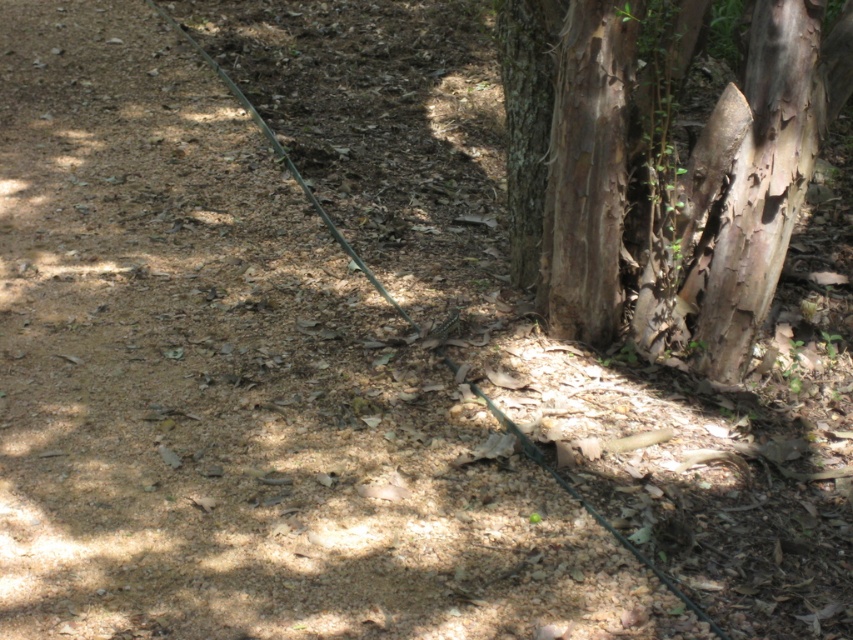
You are a hiker trying to identify two tree trunks in the forest. You see the light brown textured bark at center right and the brown rough bark tree trunk at center. Which of these two trunks has a larger size?

The light brown textured bark at center right is bigger than the brown rough bark tree trunk at center, so the light brown textured bark at center right has a larger size.

You are standing in the forest and see both the light brown textured bark at center right and the brown rough bark tree trunk at center. Which one is nearer to you?

The light brown textured bark at center right is closer to the viewer than the brown rough bark tree trunk at center.